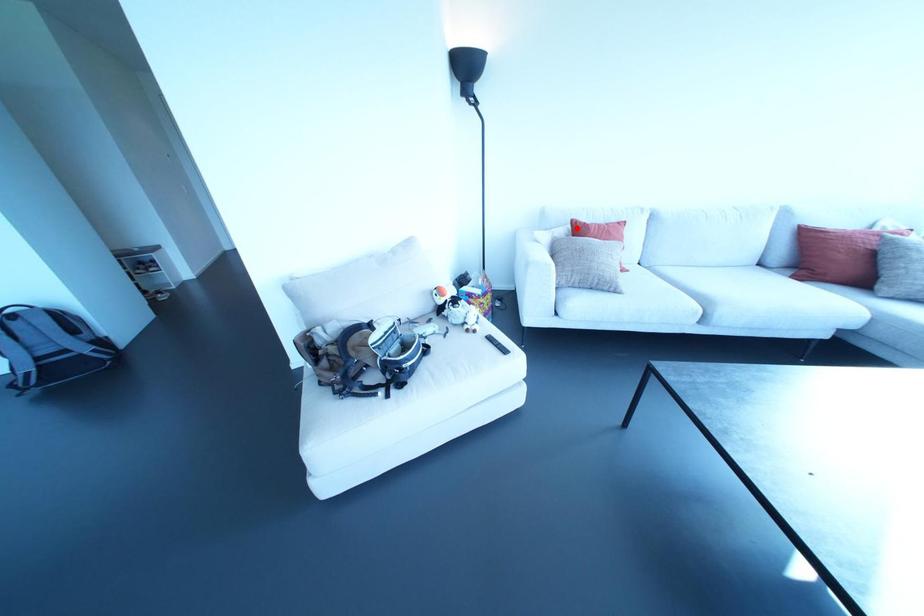
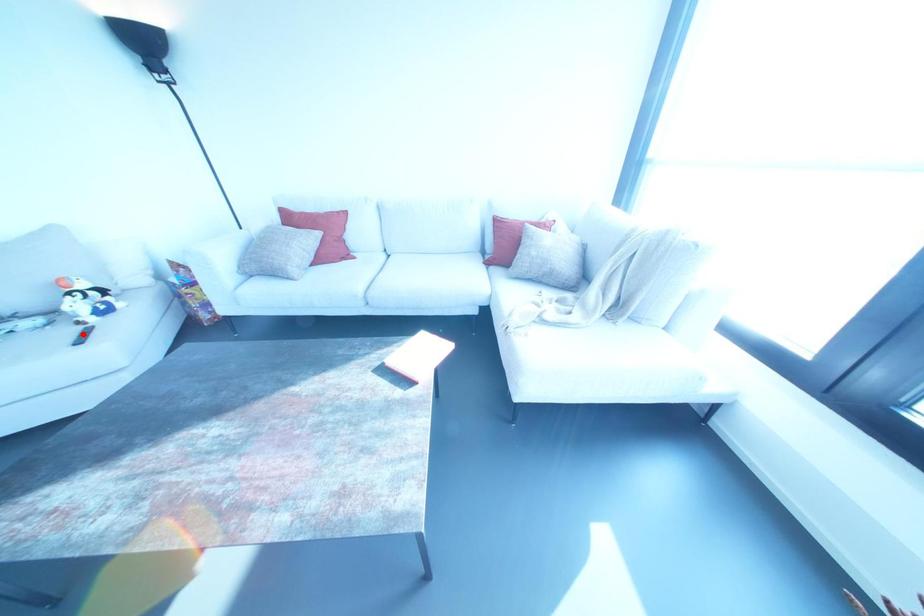
I am providing you with two images of the same scene from different viewpoints. A red point is marked on the first image and another point is marked on the second image. Is the marked point in image1 the same physical position as the marked point in image2?

No